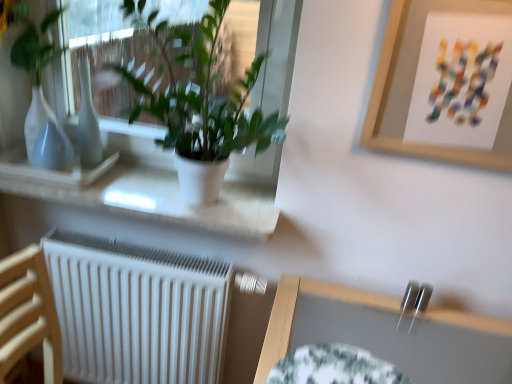
Locate an element on the screen. The width and height of the screenshot is (512, 384). free space between white glossy vase at upper left, the second vase in the left-to-right sequence, and white matte plant pot at upper left, acting as the 2th houseplant starting from the left is located at coordinates (95, 177).